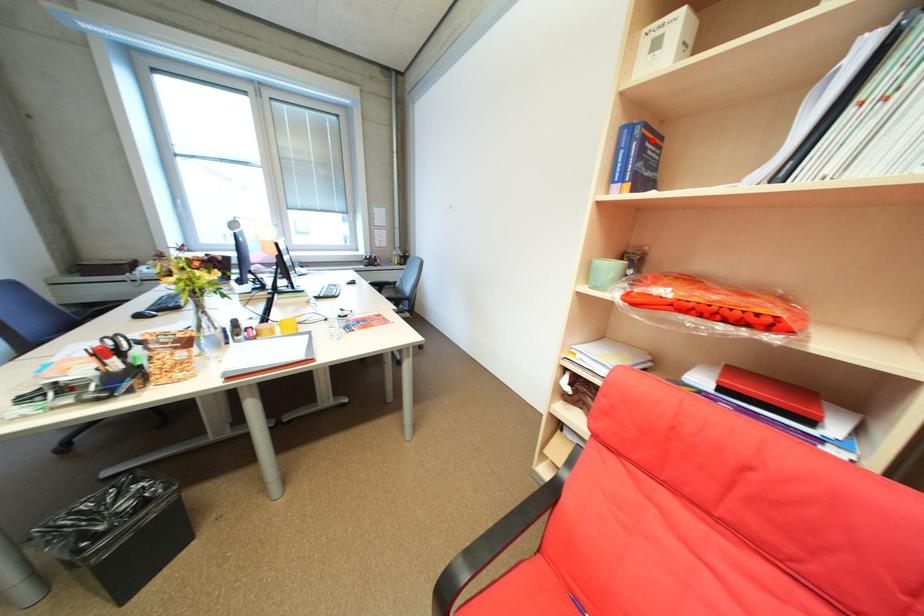
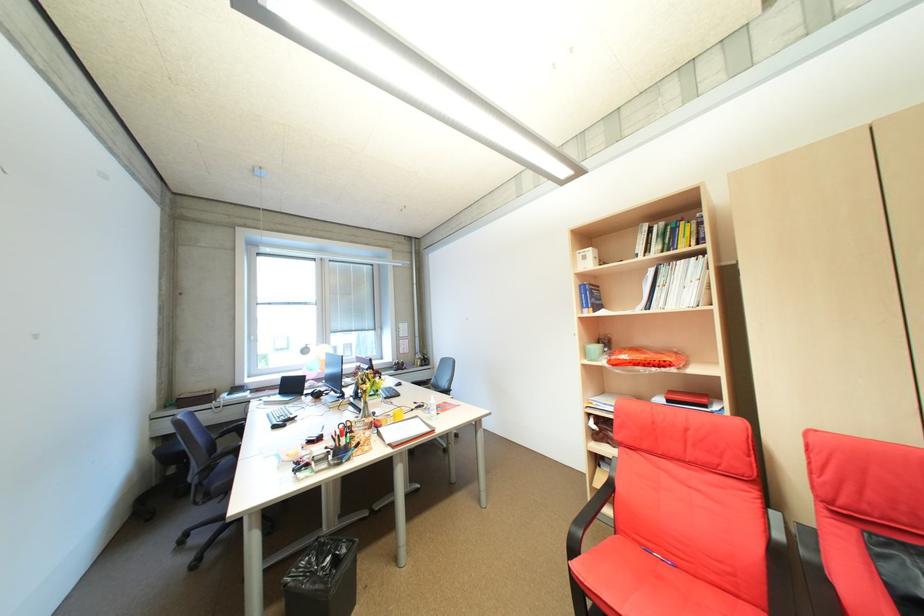
Locate, in the second image, the point that corresponds to the highlighted location in the first image.

(600, 291)